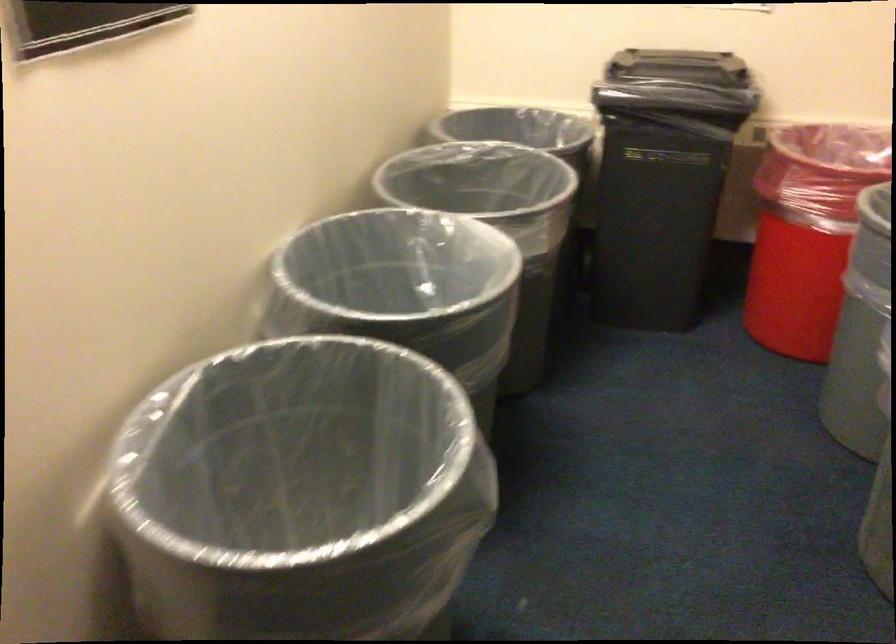
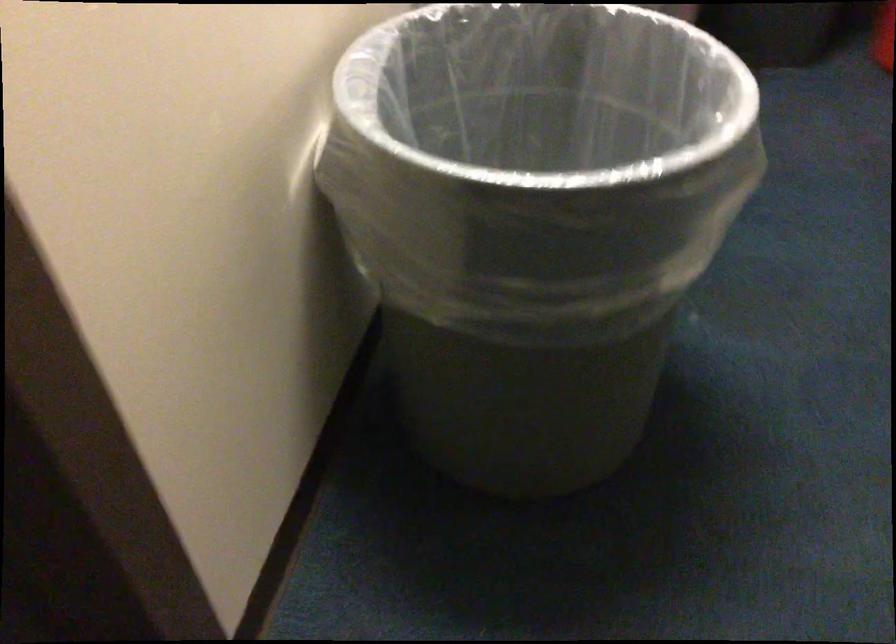
Locate, in the second image, the point that corresponds to point 240,560 in the first image.

(538, 185)